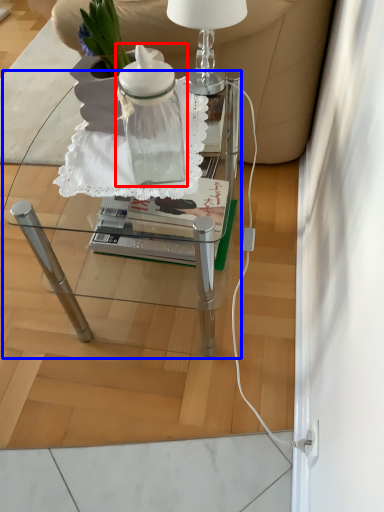
Question: Which point is closer to the camera, bottle (highlighted by a red box) or table (highlighted by a blue box)?

Choices:
 (A) bottle
 (B) table

Answer: (A)